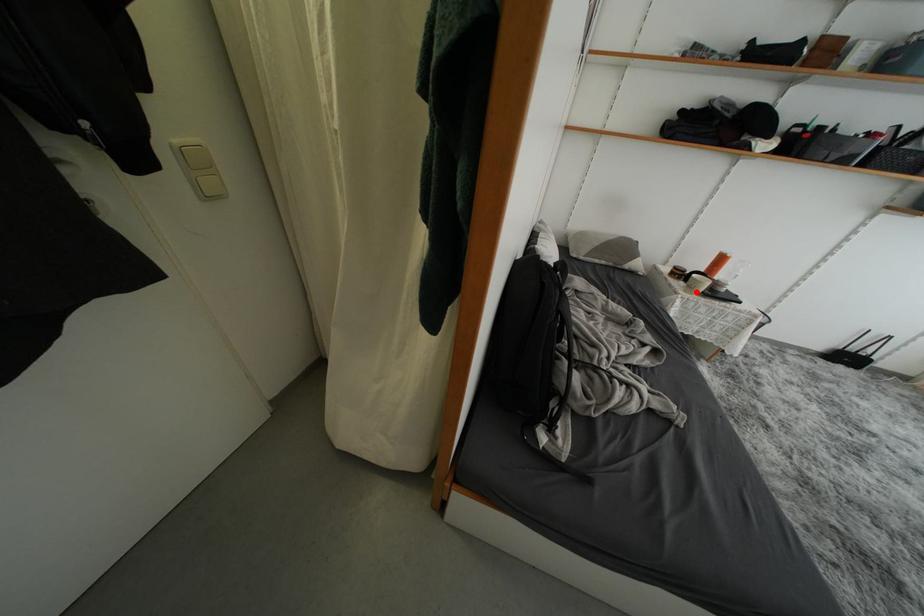
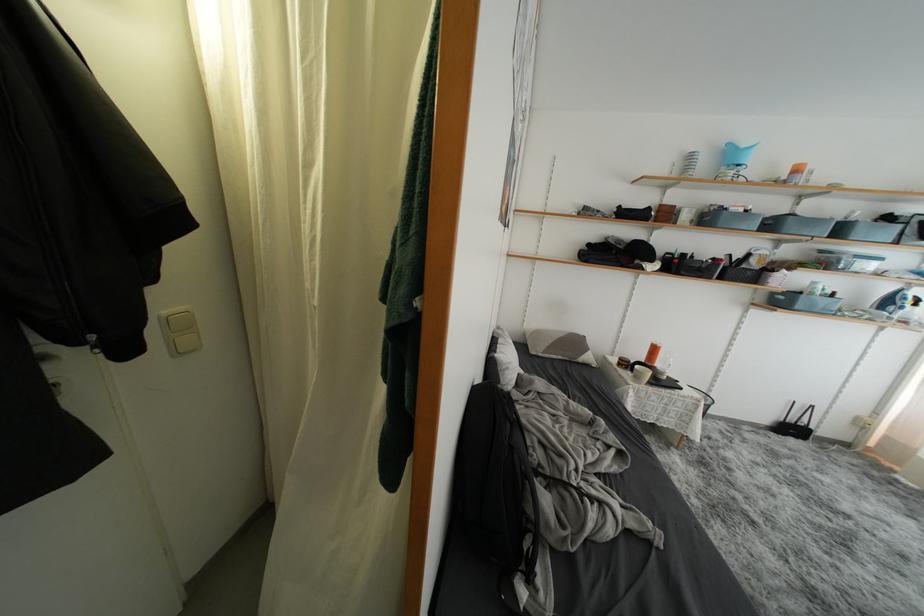
The point at the highlighted location is marked in the first image. Where is the corresponding point in the second image?

(642, 382)